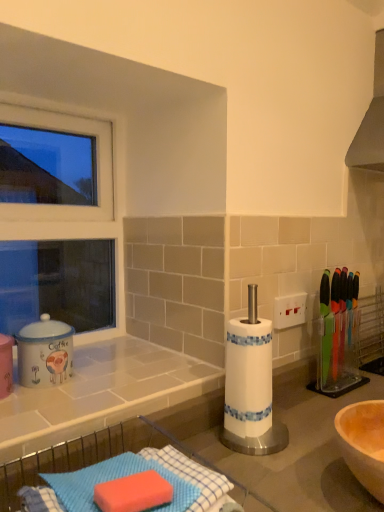
The image size is (384, 512). I want to click on vacant area in front of matte ceramic coffee canister at left, so click(x=45, y=408).